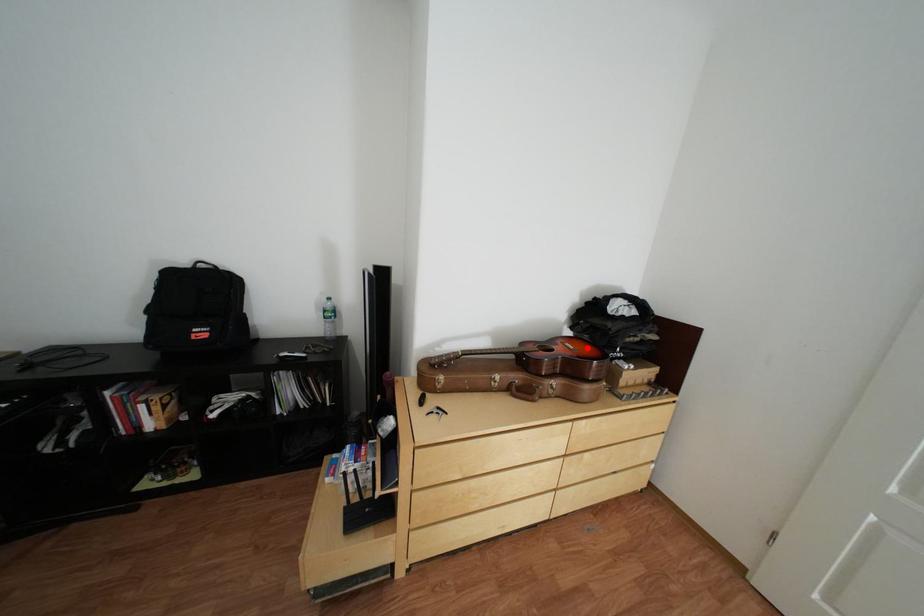
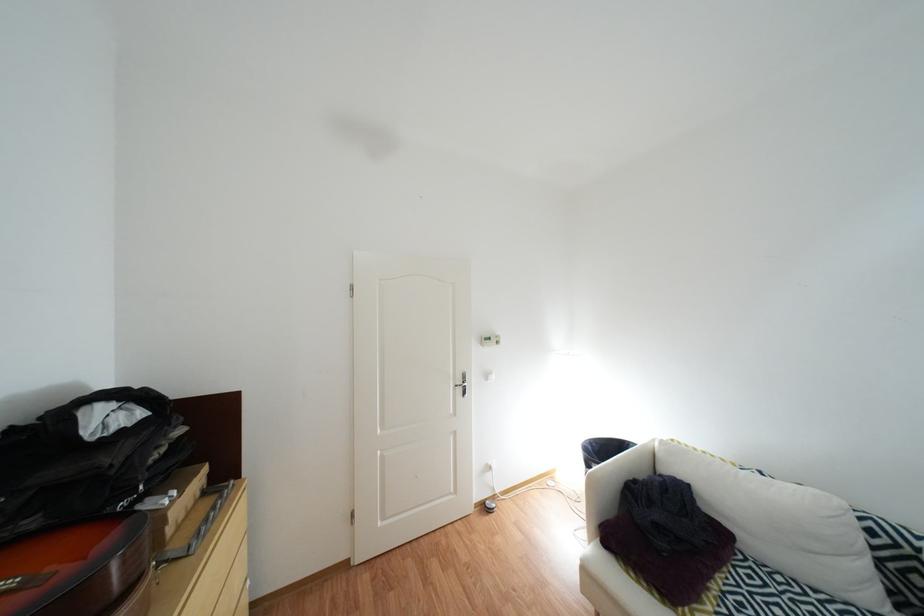
Where in the second image is the point corresponding to the highlighted location from the first image?

(27, 584)